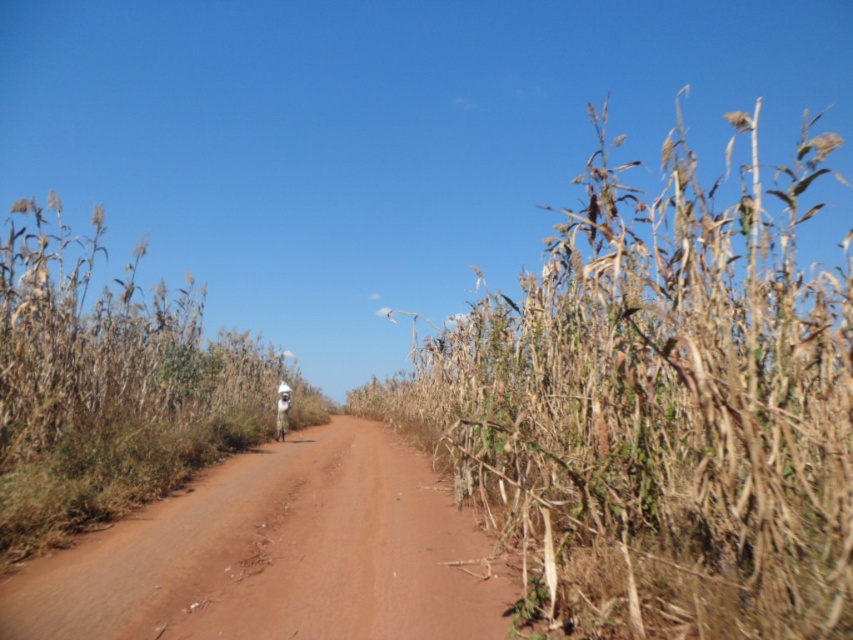
Question: Among these points, which one is farthest from the camera?

Choices:
 (A) (10, 225)
 (B) (276, 477)

Answer: (B)

Question: Does brown dirt track at center come behind brown dry stalks of corn at center?

Choices:
 (A) yes
 (B) no

Answer: (B)

Question: Among these points, which one is farthest from the camera?

Choices:
 (A) (114, 296)
 (B) (386, 419)

Answer: (B)

Question: Which point is closer to the camera taking this photo?

Choices:
 (A) (283, 596)
 (B) (505, 449)

Answer: (A)

Question: Does brown dry stalks of corn at right have a lesser width compared to brown dry stalks of corn at center?

Choices:
 (A) yes
 (B) no

Answer: (B)

Question: Is brown dry stalks of corn at right in front of brown dry stalks of corn at center?

Choices:
 (A) no
 (B) yes

Answer: (B)